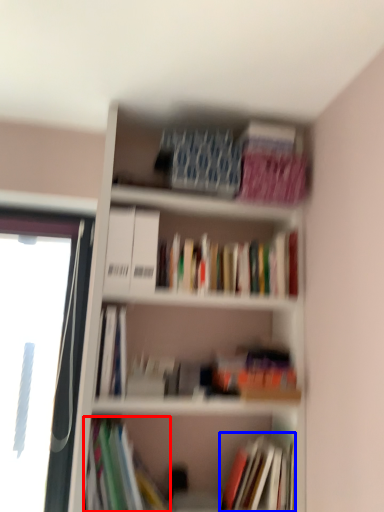
Question: Which object is closer to the camera taking this photo, book (highlighted by a red box) or book (highlighted by a blue box)?

Choices:
 (A) book
 (B) book

Answer: (A)